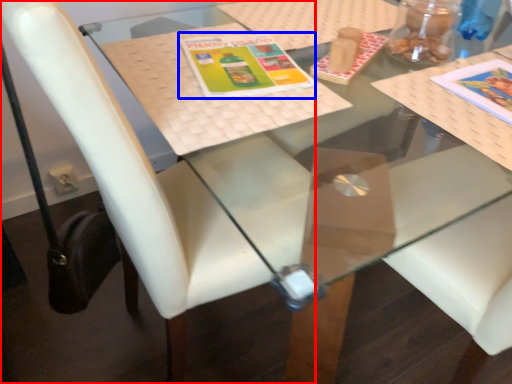
Question: Which object appears farthest to the camera in this image, chair (highlighted by a red box) or book cover (highlighted by a blue box)?

Choices:
 (A) chair
 (B) book cover

Answer: (B)